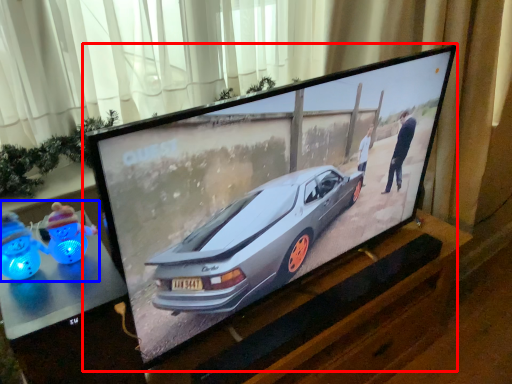
Question: Among these objects, which one is nearest to the camera, television (highlighted by a red box) or toy (highlighted by a blue box)?

Choices:
 (A) television
 (B) toy

Answer: (A)